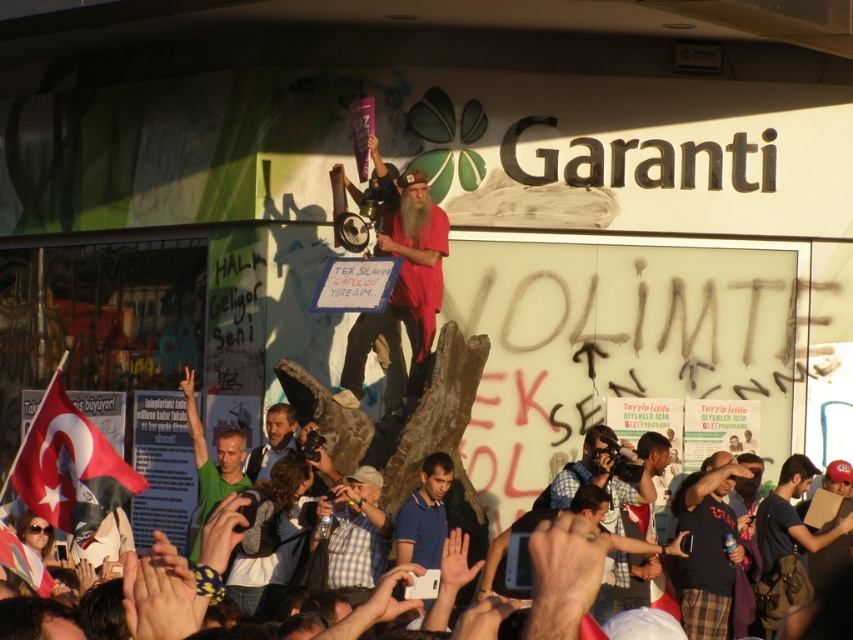
Question: Which of the following is the farthest from the observer?

Choices:
 (A) (642, 570)
 (B) (228, 492)
 (C) (416, 490)
 (D) (393, 300)

Answer: (A)

Question: Which of the following is the farthest from the observer?

Choices:
 (A) (281, 456)
 (B) (405, 323)
 (C) (717, 538)
 (D) (805, 547)

Answer: (D)

Question: Is white fabric flag at lower left wider than checkered fabric shirt at center?

Choices:
 (A) yes
 (B) no

Answer: (A)

Question: Is checkered fabric shirt at center bigger than blue cotton shirt at center?

Choices:
 (A) no
 (B) yes

Answer: (B)

Question: From the image, what is the correct spatial relationship of white fabric flag at lower left in relation to green fabric shirt at center?

Choices:
 (A) below
 (B) above

Answer: (A)

Question: Among these points, which one is nearest to the camera?

Choices:
 (A) [x=428, y=474]
 (B) [x=271, y=417]
 (C) [x=93, y=464]

Answer: (C)